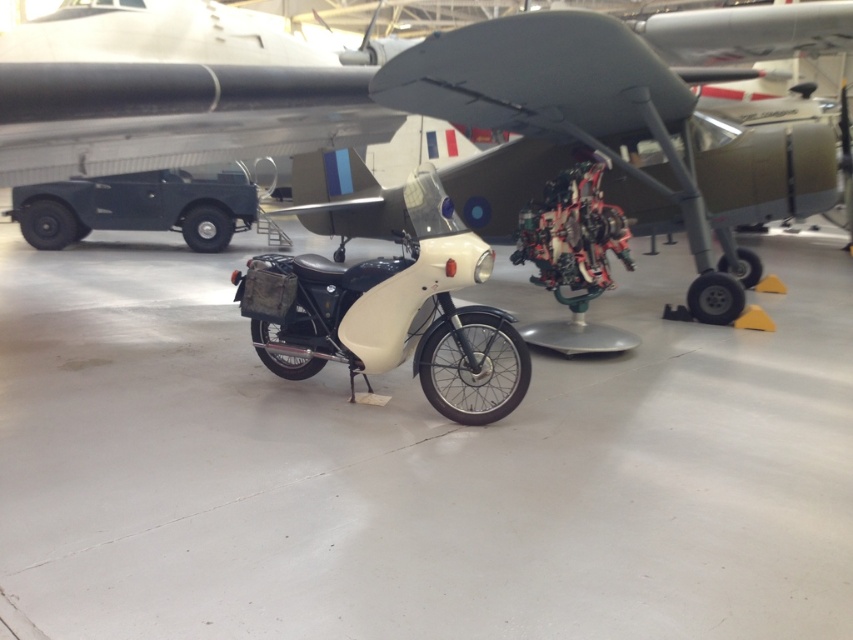
Question: Which point is farther to the camera?

Choices:
 (A) pos(585,54)
 (B) pos(447,392)

Answer: (A)

Question: Is metallic gray airplane at center to the left of white matte motorcycle at center from the viewer's perspective?

Choices:
 (A) yes
 (B) no

Answer: (B)

Question: Is metallic gray airplane at center to the left of white matte motorcycle at center from the viewer's perspective?

Choices:
 (A) yes
 (B) no

Answer: (B)

Question: Is metallic gray airplane at center bigger than white matte motorcycle at center?

Choices:
 (A) yes
 (B) no

Answer: (A)

Question: Which object is farther from the camera taking this photo?

Choices:
 (A) metallic gray airplane at center
 (B) white matte motorcycle at center

Answer: (A)